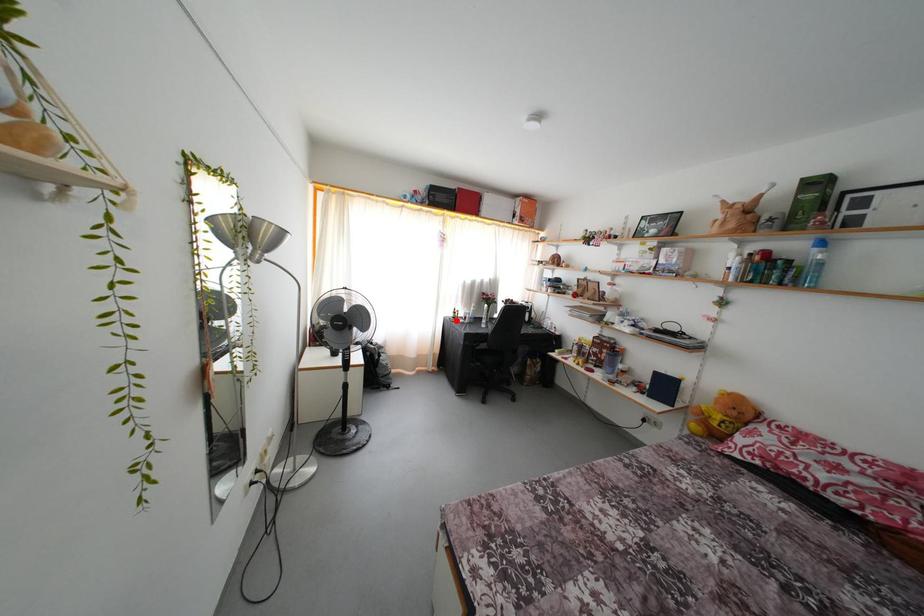
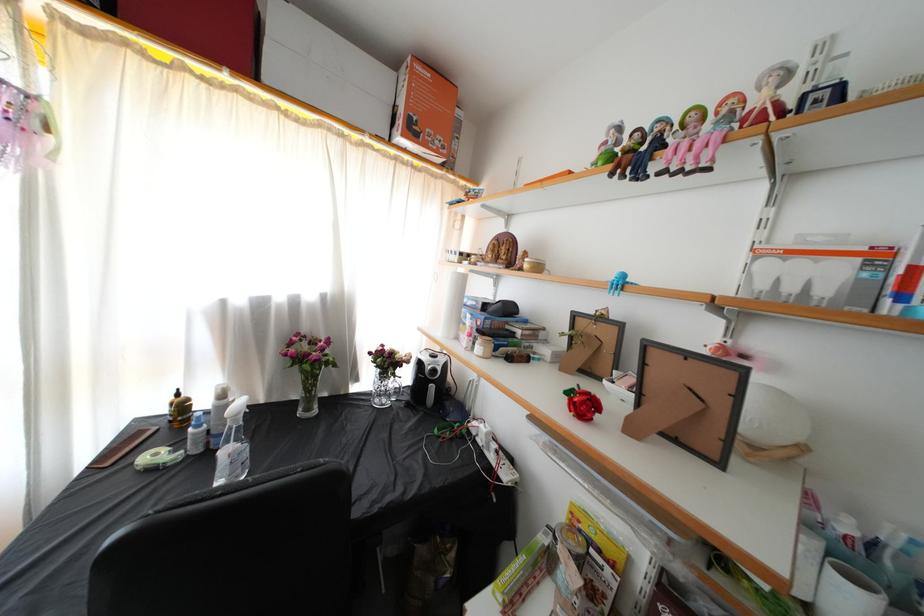
Question: I am providing you with two images of the same scene from different viewpoints. A red point is marked on the first image. Is the red point's position out of view in image 2?

Choices:
 (A) Yes
 (B) No

Answer: (B)